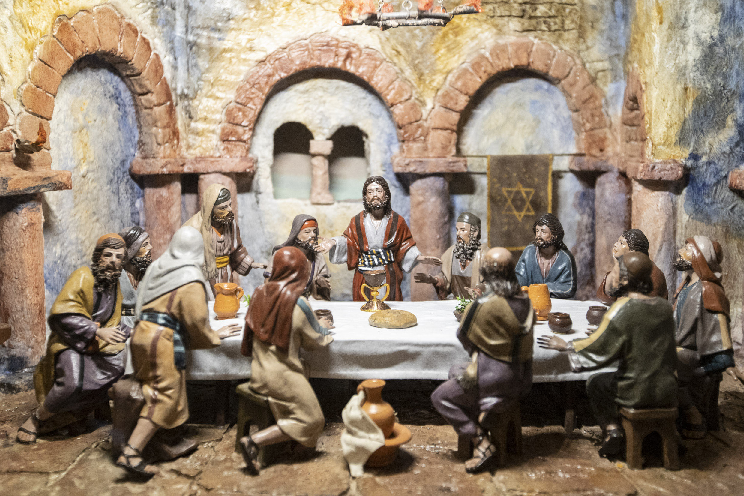
Where is `stone tile`? The height and width of the screenshot is (496, 744). stone tile is located at coordinates (443, 476), (568, 475), (682, 480), (434, 430), (285, 480), (93, 475), (51, 446), (19, 483), (728, 405).